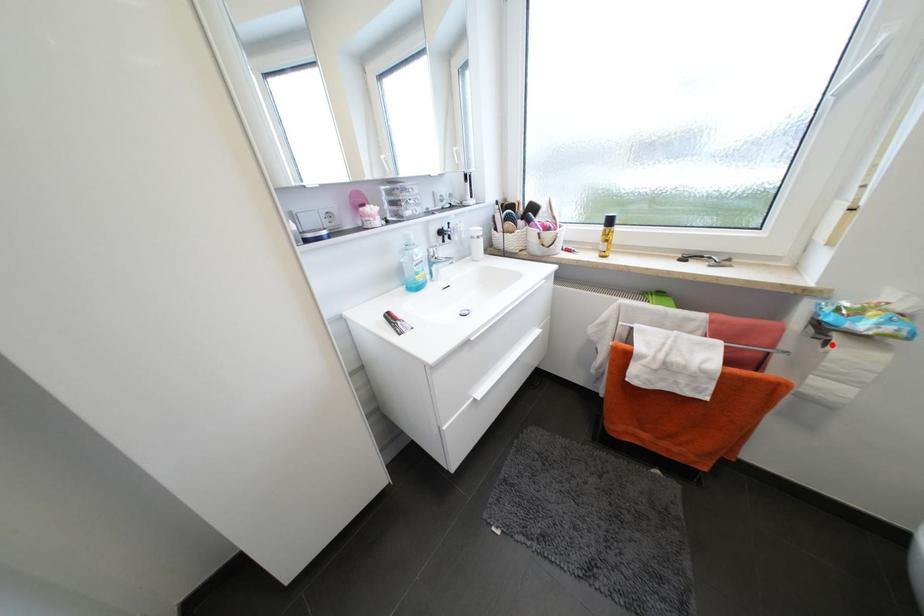
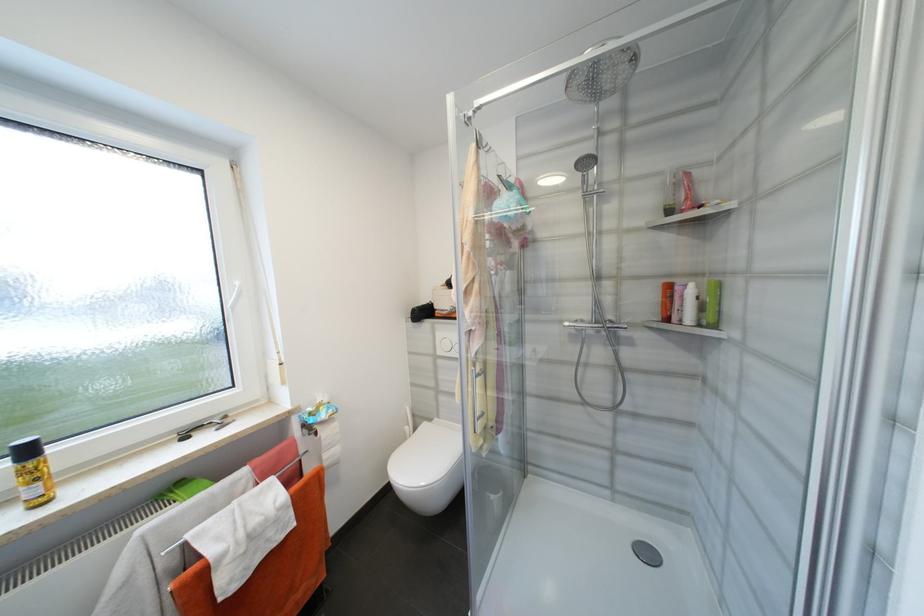
Where in the second image is the point corresponding to the highlighted location from the first image?

(322, 435)